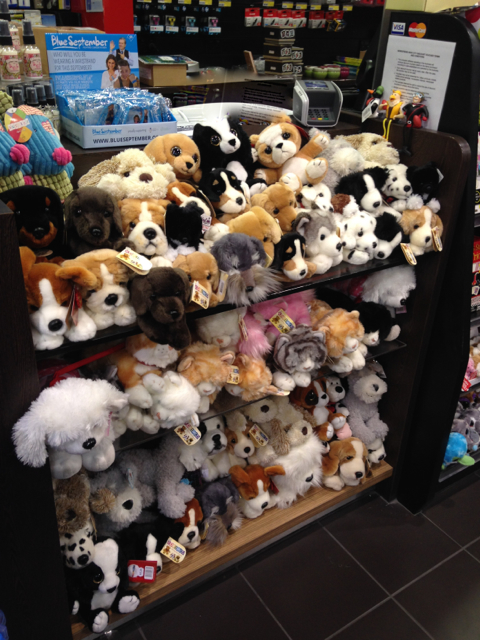
At what (x,y) coordinates should I click in order to perform the action: click on floor. Please return your answer as a coordinate pair (x, y). Looking at the image, I should click on (373, 570).